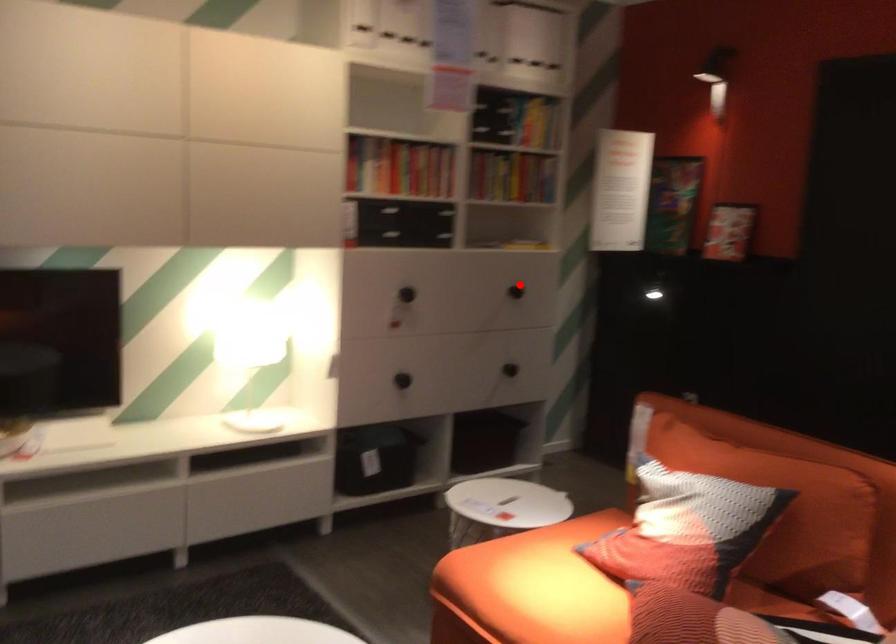
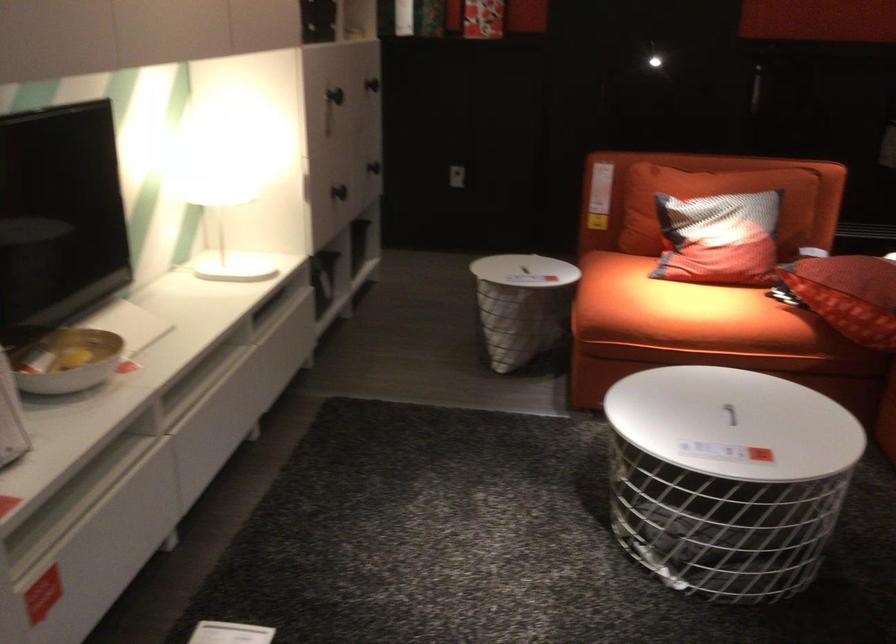
The point at the highlighted location is marked in the first image. Where is the corresponding point in the second image?

(372, 84)